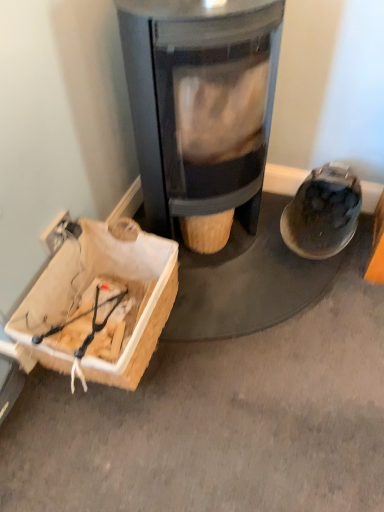
Question: Can you confirm if matte black shoe at right is smaller than matte black wood burning stove at center?

Choices:
 (A) no
 (B) yes

Answer: (B)

Question: Can you confirm if matte black shoe at right is taller than matte black wood burning stove at center?

Choices:
 (A) yes
 (B) no

Answer: (B)

Question: Is matte black shoe at right further to the viewer compared to matte black wood burning stove at center?

Choices:
 (A) no
 (B) yes

Answer: (B)

Question: From the image's perspective, would you say matte black shoe at right is positioned over matte black wood burning stove at center?

Choices:
 (A) yes
 (B) no

Answer: (B)

Question: Is matte black shoe at right outside matte black wood burning stove at center?

Choices:
 (A) yes
 (B) no

Answer: (A)

Question: Visually, is matte black wood burning stove at center positioned to the left or to the right of matte black shoe at right?

Choices:
 (A) left
 (B) right

Answer: (A)

Question: Looking at the image, does matte black wood burning stove at center seem bigger or smaller compared to matte black shoe at right?

Choices:
 (A) big
 (B) small

Answer: (A)

Question: Is matte black wood burning stove at center wider or thinner than matte black shoe at right?

Choices:
 (A) thin
 (B) wide

Answer: (B)

Question: Relative to matte black shoe at right, is matte black wood burning stove at center in front or behind?

Choices:
 (A) behind
 (B) front

Answer: (B)

Question: In terms of height, does matte black shoe at right look taller or shorter compared to matte black wood burning stove at center?

Choices:
 (A) tall
 (B) short

Answer: (B)

Question: Choose the correct answer: Is matte black shoe at right inside matte black wood burning stove at center or outside it?

Choices:
 (A) outside
 (B) inside

Answer: (A)

Question: From the image's perspective, relative to matte black wood burning stove at center, is matte black shoe at right above or below?

Choices:
 (A) above
 (B) below

Answer: (B)

Question: In terms of size, does matte black shoe at right appear bigger or smaller than matte black wood burning stove at center?

Choices:
 (A) big
 (B) small

Answer: (B)

Question: From the image's perspective, relative to matte black shoe at right, is wooden crate at lower left above or below?

Choices:
 (A) below
 (B) above

Answer: (A)

Question: Considering their positions, is wooden crate at lower left located in front of or behind matte black shoe at right?

Choices:
 (A) behind
 (B) front

Answer: (B)